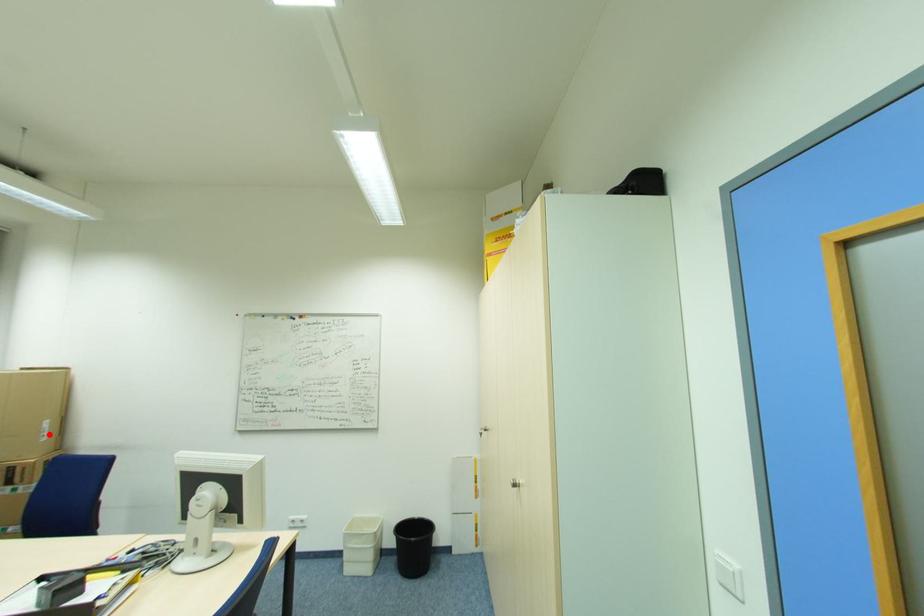
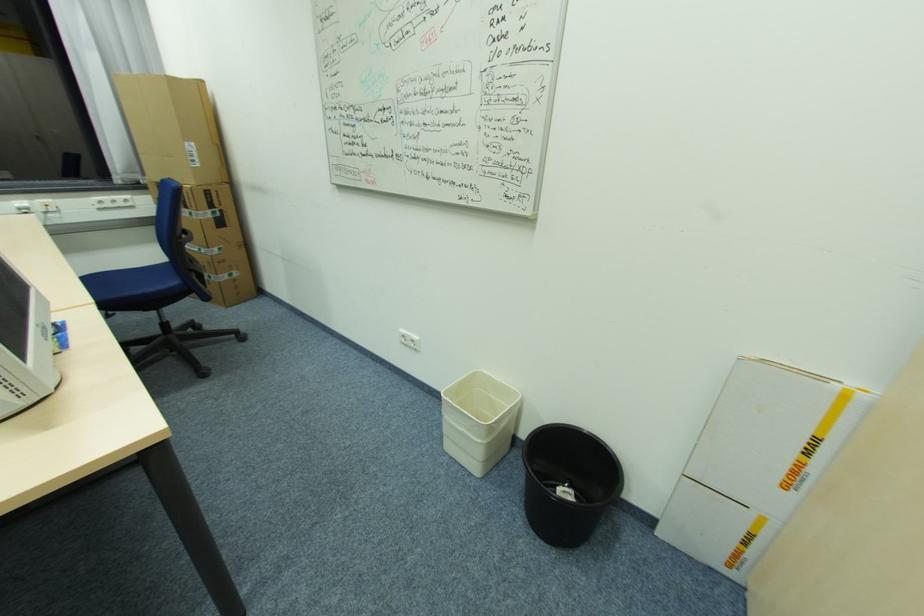
Question: A red point is marked in image1. In image2, is the corresponding 3D point closer to the camera or farther? Reply with the corresponding letter.

Choices:
 (A) The corresponding 3D point is closer.
 (B) The corresponding 3D point is farther.

Answer: (B)